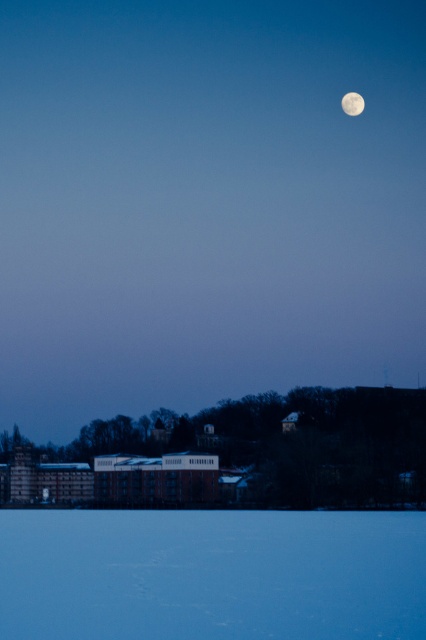
You are an astronomer observing the twilight scene. You notice the white glossy moon at upper right. Based on its position, can you determine if it is a waxing or waning moon phase?

The white glossy moon at upper right is located at point coordinates that indicate it is in the waxing phase, as its illuminated portion faces the east, typical of phases between new moon and full moon.

You are an astronomer observing the night sky and notice two moons in the scene. Which moon, the white glossy moon at upper right or the white smooth moon at upper center, appears closer to you?

The white glossy moon at upper right appears closer to you because it is positioned closer to the viewer than the white smooth moon at upper center.